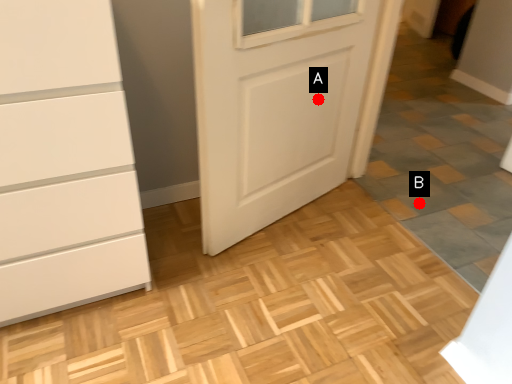
Question: Two points are circled on the image, labeled by A and B beside each circle. Which of the following is the farthest from the observer?

Choices:
 (A) A is further
 (B) B is further

Answer: (B)